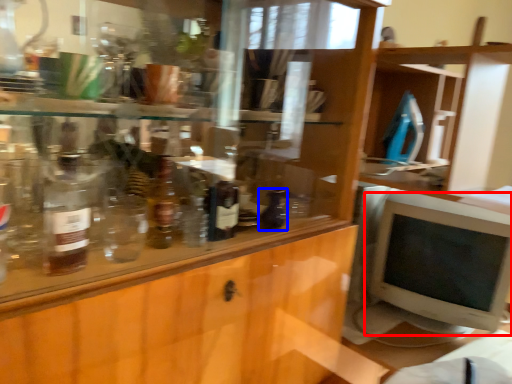
Question: Among these objects, which one is farthest to the camera, computer monitor (highlighted by a red box) or bottle (highlighted by a blue box)?

Choices:
 (A) computer monitor
 (B) bottle

Answer: (A)